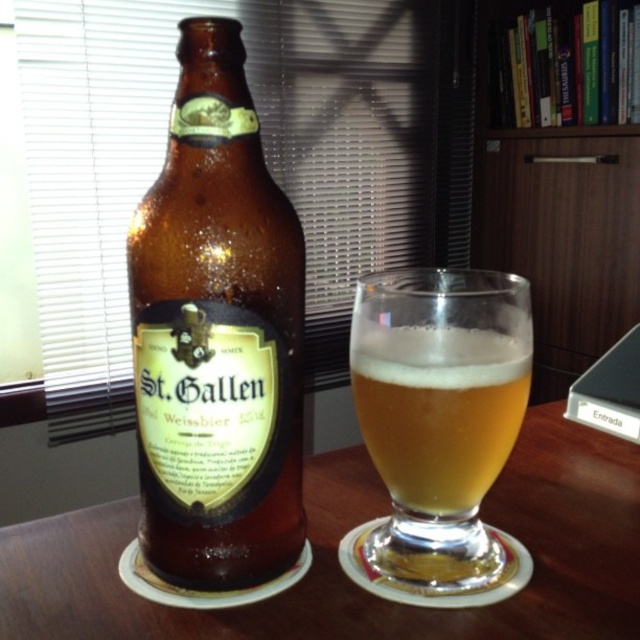
Question: Among these points, which one is nearest to the camera?

Choices:
 (A) (564, 305)
 (B) (396, 541)
 (C) (330, 628)

Answer: (C)

Question: Can you confirm if brown glass bottle at left is positioned to the left of brown wooden table at center?

Choices:
 (A) yes
 (B) no

Answer: (A)

Question: Among these points, which one is farthest from the camera?

Choices:
 (A) (593, 493)
 (B) (602, 157)

Answer: (B)

Question: Does brown wooden table at center appear under translucent glass beer at center?

Choices:
 (A) no
 (B) yes

Answer: (B)

Question: Does brown glass bottle at left have a lesser width compared to translucent glass beer at center?

Choices:
 (A) no
 (B) yes

Answer: (B)

Question: Which object appears closest to the camera in this image?

Choices:
 (A) brown glass bottle at left
 (B) wooden cabinet at upper right
 (C) brown wooden table at center
 (D) translucent glass beer at center

Answer: (A)